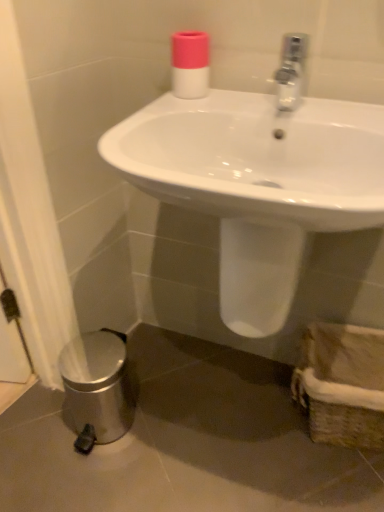
Question: From a real-world perspective, is pink matte bottle at upper center beneath white glossy sink at center?

Choices:
 (A) no
 (B) yes

Answer: (A)

Question: Does pink matte bottle at upper center have a greater height compared to white glossy sink at center?

Choices:
 (A) yes
 (B) no

Answer: (B)

Question: Can you confirm if pink matte bottle at upper center is positioned to the right of white glossy sink at center?

Choices:
 (A) yes
 (B) no

Answer: (B)

Question: Can you confirm if pink matte bottle at upper center is thinner than white glossy sink at center?

Choices:
 (A) no
 (B) yes

Answer: (B)

Question: Could you tell me if pink matte bottle at upper center is turned towards white glossy sink at center?

Choices:
 (A) no
 (B) yes

Answer: (A)

Question: Can you confirm if pink matte bottle at upper center is wider than white glossy sink at center?

Choices:
 (A) yes
 (B) no

Answer: (B)

Question: Is pink matte bottle at upper center thinner than brown woven basket at lower right?

Choices:
 (A) yes
 (B) no

Answer: (A)

Question: Is pink matte bottle at upper center at the left side of brown woven basket at lower right?

Choices:
 (A) yes
 (B) no

Answer: (A)

Question: From a real-world perspective, is pink matte bottle at upper center located beneath brown woven basket at lower right?

Choices:
 (A) yes
 (B) no

Answer: (B)

Question: Does pink matte bottle at upper center have a greater height compared to brown woven basket at lower right?

Choices:
 (A) yes
 (B) no

Answer: (B)

Question: Is there a large distance between pink matte bottle at upper center and brown woven basket at lower right?

Choices:
 (A) yes
 (B) no

Answer: (B)

Question: Is pink matte bottle at upper center bigger than brown woven basket at lower right?

Choices:
 (A) yes
 (B) no

Answer: (B)

Question: From the image's perspective, would you say brown woven basket at lower right is shown under white glossy sink at center?

Choices:
 (A) yes
 (B) no

Answer: (A)